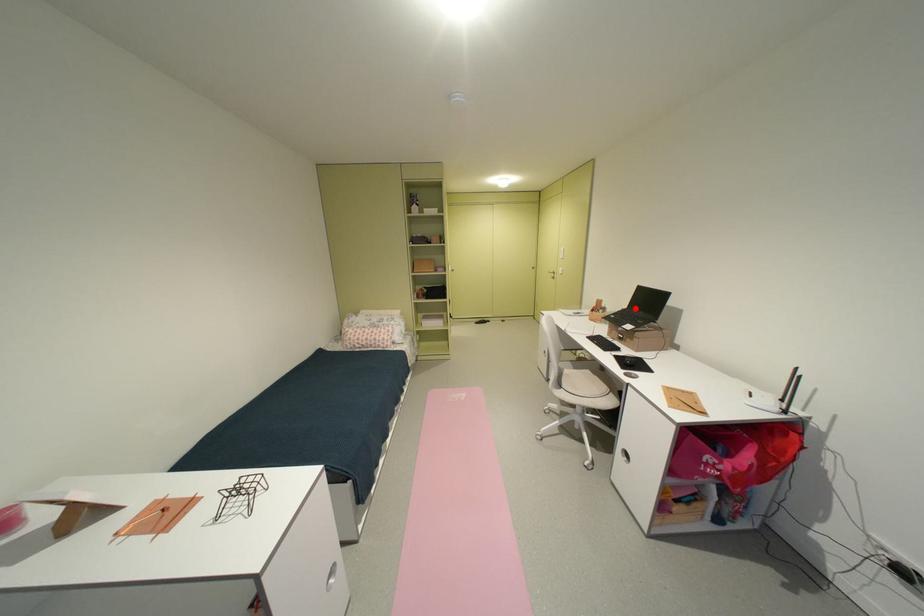
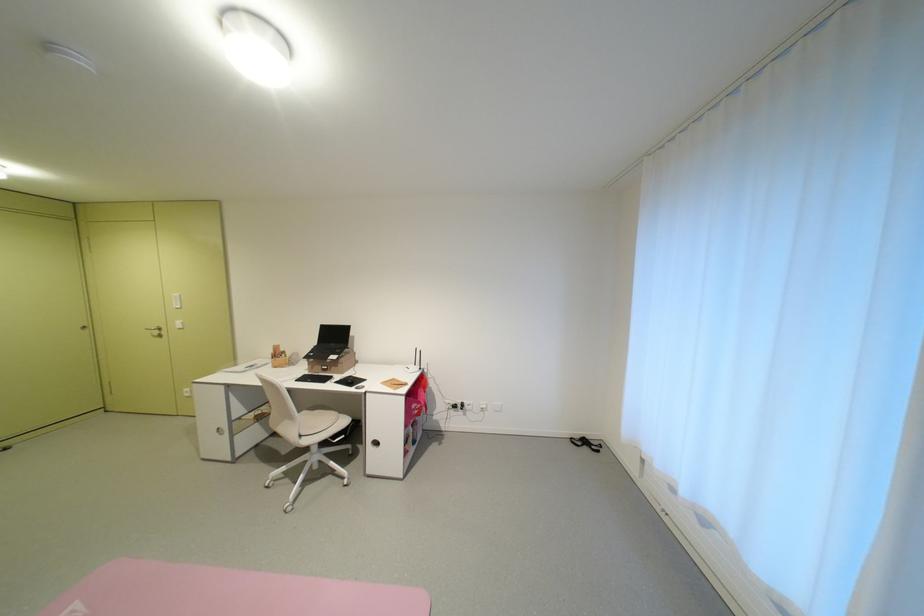
Question: I am providing you with two images of the same scene from different viewpoints. In image1, a red point is highlighted. Considering the same 3D point in image2, which of the following is correct?

Choices:
 (A) It is closer
 (B) It is farther

Answer: (B)